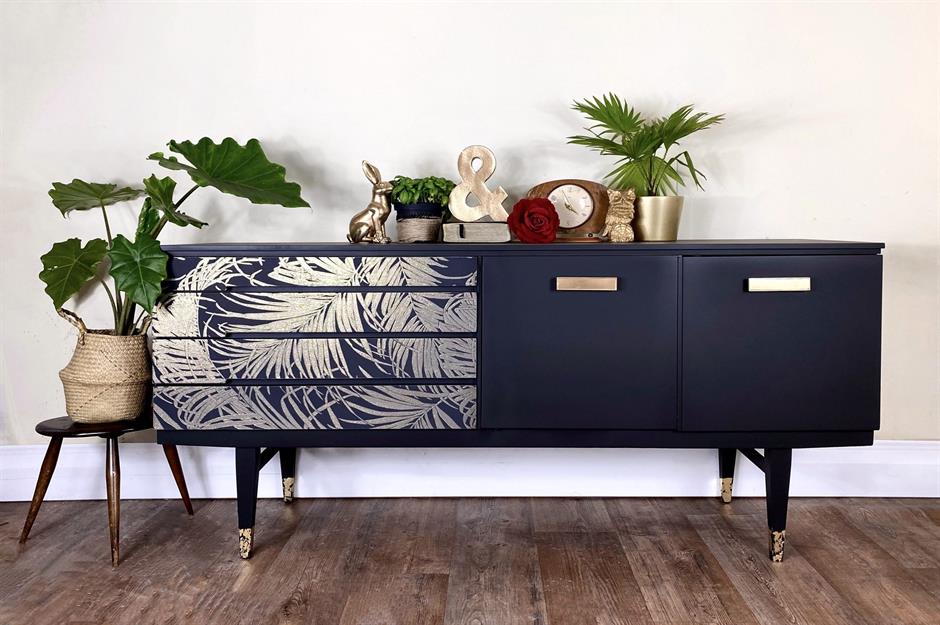
Find the location of a particular element. handle is located at coordinates (604, 287).